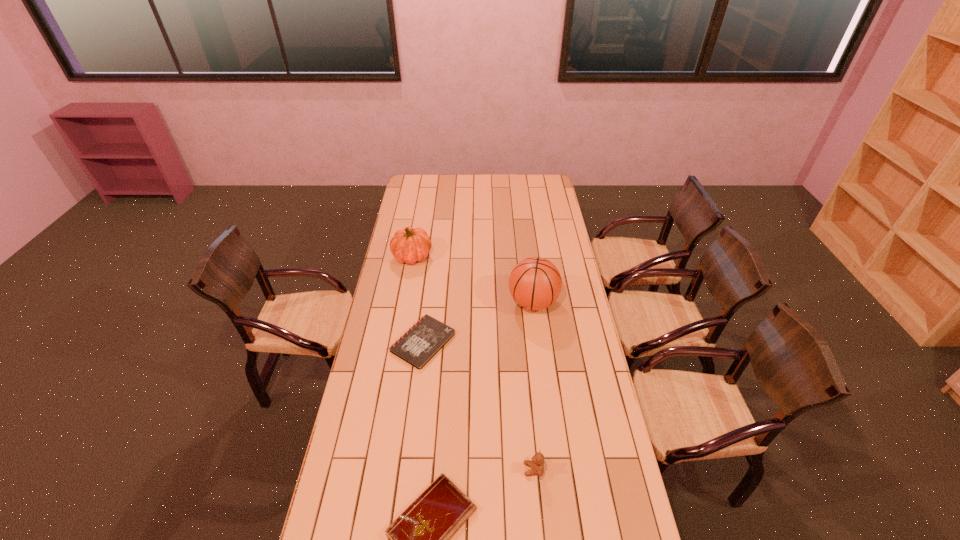
This screenshot has width=960, height=540. I want to click on vacant area between the pumpkin and the farther notebook, so click(418, 299).

The image size is (960, 540). What are the coordinates of `free space between the basketball and the second tallest object` in the screenshot? It's located at (472, 279).

The image size is (960, 540). What are the coordinates of `free spot between the third tallest object and the farther notebook` in the screenshot? It's located at (478, 406).

Identify the location of vacant area that lies between the farther notebook and the pumpkin. The height and width of the screenshot is (540, 960). (418, 299).

At what (x,y) coordinates should I click in order to perform the action: click on vacant area that lies between the pumpkin and the third shortest object. Please return your answer as a coordinate pair (x, y). This screenshot has height=540, width=960. Looking at the image, I should click on (472, 363).

Locate which object is the fourth closest to the pumpkin. Please provide its 2D coordinates. Your answer should be formatted as a tuple, i.e. [(x, y)], where the tuple contains the x and y coordinates of a point satisfying the conditions above.

[(537, 464)]

Find the location of `the second closest object to the tallest object`. the second closest object to the tallest object is located at coordinates click(409, 245).